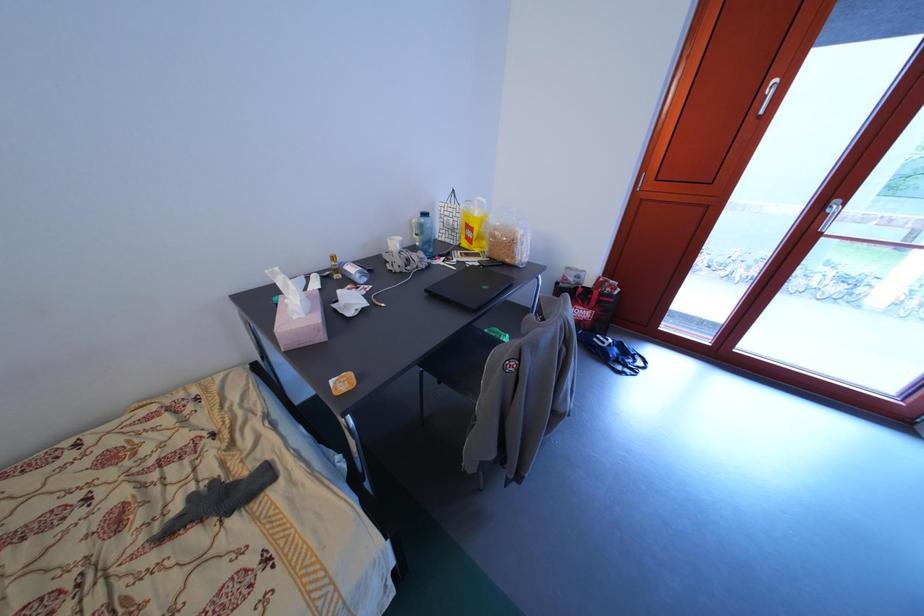
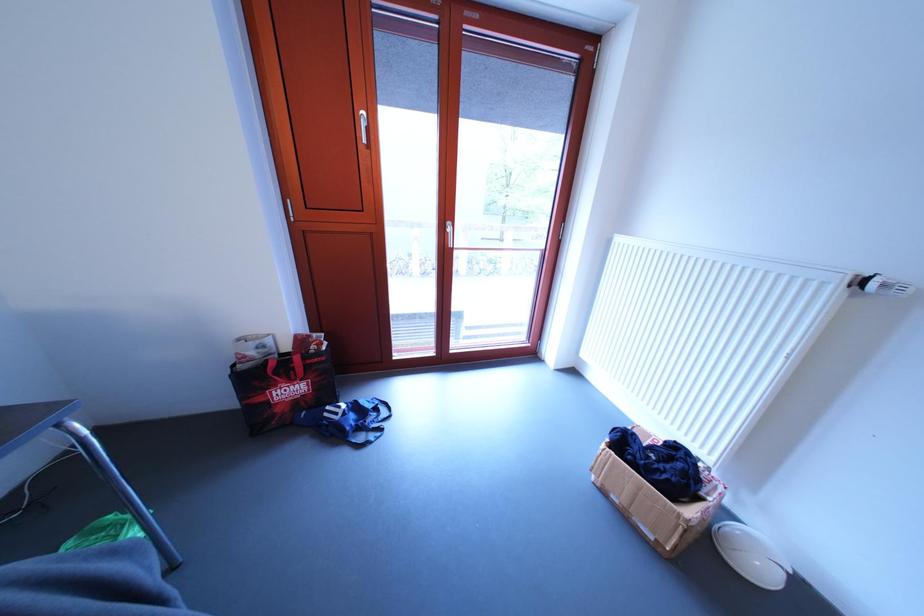
Question: Based on the continuous images, in which direction is the camera rotating? Reply with the corresponding letter.

Choices:
 (A) Left
 (B) Right
 (C) Up
 (D) Down

Answer: (B)